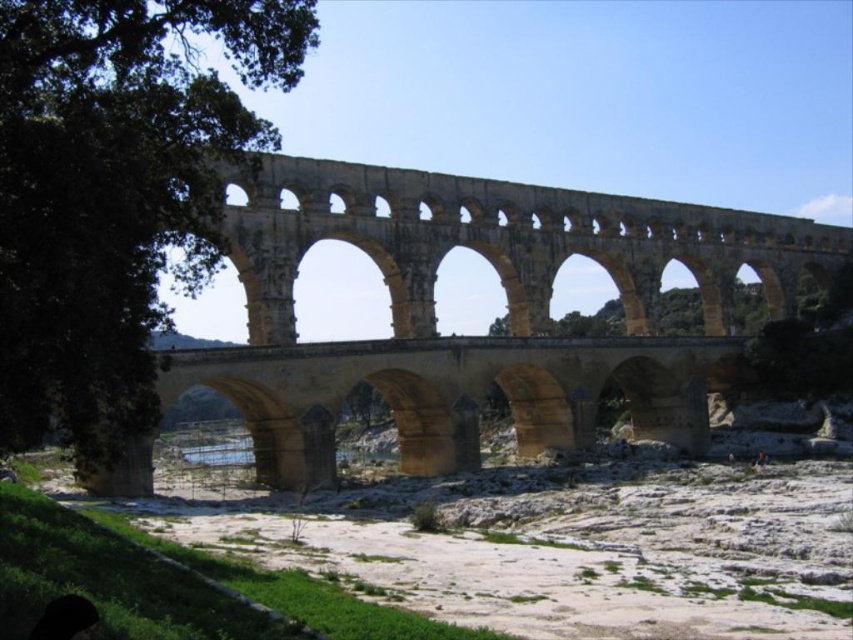
You are a tourist standing at the base of the yellow stone bridge at center. You want to take a photo of the green leafy tree at left without any obstructions. Can you do so from your current position?

The yellow stone bridge at center and green leafy tree at left are 24.26 meters apart from each other. Since the distance is sufficient, you can take a photo of the green leafy tree at left without any obstructions from your current position at the base of the yellow stone bridge at center.

You are standing on a path near the yellow stone bridge at center and want to take a photo of it. There is a green leafy tree at left nearby. To avoid the tree blocking the view, should you move to the right or left of the bridge?

The yellow stone bridge at center is positioned under the green leafy tree at left, so to avoid the tree blocking the view, you should move to the right of the yellow stone bridge at center.